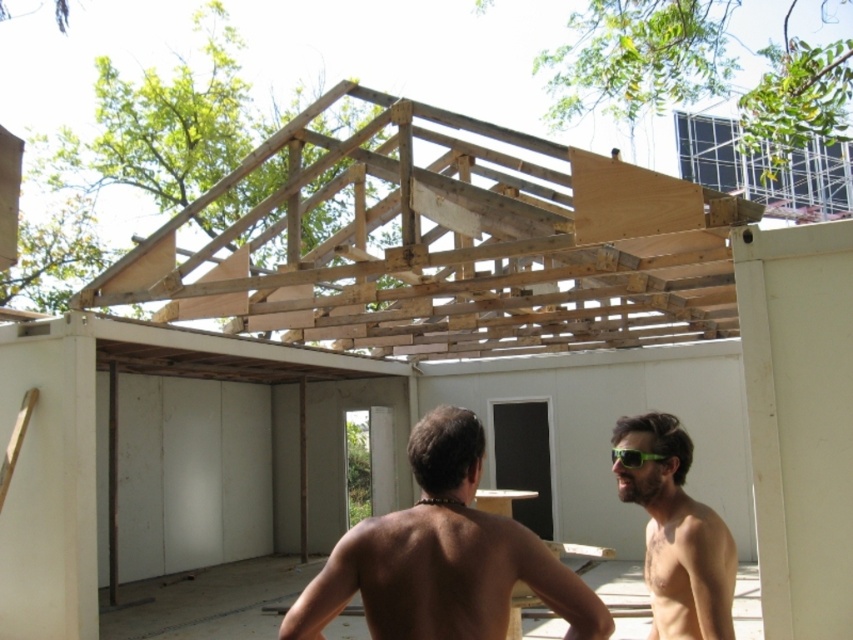
You are a safety inspector at the construction site. You notice two workers, one with brown skin at center and the natural wood roof at upper center. From your vantage point, which worker is closer to the front of the scene?

The natural wood roof at upper center is closer to the front of the scene because the brown skin at center is positioned behind it.

You are an architect visiting a construction site. You notice the natural wood roof at upper center and the brown skin at center. Which object takes up more space in the image?

The natural wood roof at upper center is bigger than brown skin at center, so it takes up more space in the image.